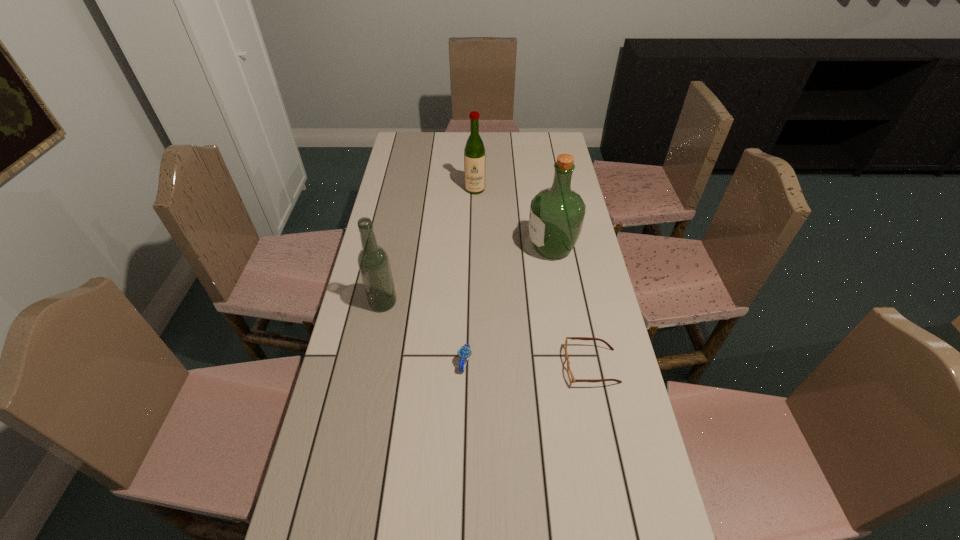
Where is `vacant space at the far edge`? This screenshot has width=960, height=540. vacant space at the far edge is located at coordinates (508, 147).

Where is `vacant region at the left edge of the desktop`? This screenshot has width=960, height=540. vacant region at the left edge of the desktop is located at coordinates (404, 186).

I want to click on free space at the right edge of the desktop, so click(599, 294).

This screenshot has height=540, width=960. In the image, there is a desktop. What are the coordinates of `vacant space at the far right corner` in the screenshot? It's located at (562, 133).

Find the location of a particular element. The image size is (960, 540). free space between the spectacles and the watch is located at coordinates (528, 364).

In order to click on free space that is in between the second liquor from right to left and the watch in this screenshot , I will do click(x=470, y=276).

The width and height of the screenshot is (960, 540). I want to click on vacant area that lies between the farthest object and the rightmost liquor, so click(514, 219).

Locate an element on the screen. The image size is (960, 540). vacant area that lies between the watch and the fourth nearest object is located at coordinates (509, 305).

Locate an element on the screen. empty space that is in between the farthest liquor and the spectacles is located at coordinates (533, 278).

This screenshot has height=540, width=960. I want to click on empty space between the watch and the farthest liquor, so click(x=470, y=276).